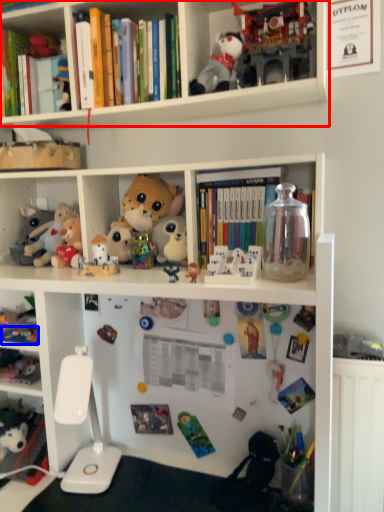
Question: Which point is further to the camera, shelf (highlighted by a red box) or toy (highlighted by a blue box)?

Choices:
 (A) shelf
 (B) toy

Answer: (B)